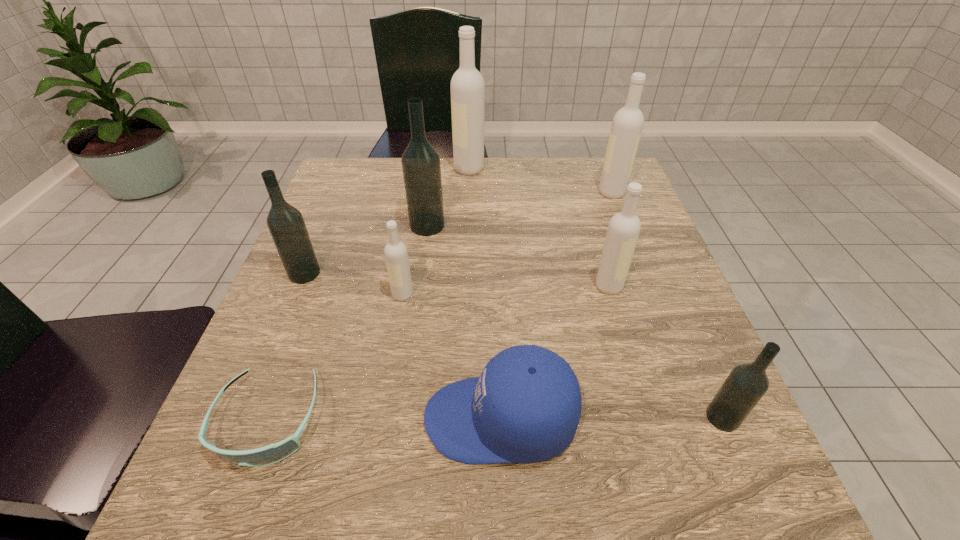
Locate which vodka ranks second in proximity to the leftmost vodka. Please provide its 2D coordinates. Your answer should be formatted as a tuple, i.e. [(x, y)], where the tuple contains the x and y coordinates of a point satisfying the conditions above.

[(421, 167)]

This screenshot has height=540, width=960. Identify the location of white vodka that is the third closest to the shortest object. (467, 84).

The image size is (960, 540). In order to click on the second closest white vodka to the seventh object from left to right in this screenshot , I will do `click(396, 255)`.

Identify which black vodka is the nearest to the rightmost black vodka. Please provide its 2D coordinates. Your answer should be formatted as a tuple, i.e. [(x, y)], where the tuple contains the x and y coordinates of a point satisfying the conditions above.

[(421, 167)]

The height and width of the screenshot is (540, 960). I want to click on black vodka identified as the closest to the second farthest black vodka, so click(421, 167).

Locate an element on the screen. The height and width of the screenshot is (540, 960). blank space that satisfies the following two spatial constraints: 1. on the back side of the farthest black vodka; 2. on the right side of the leftmost vodka is located at coordinates (324, 226).